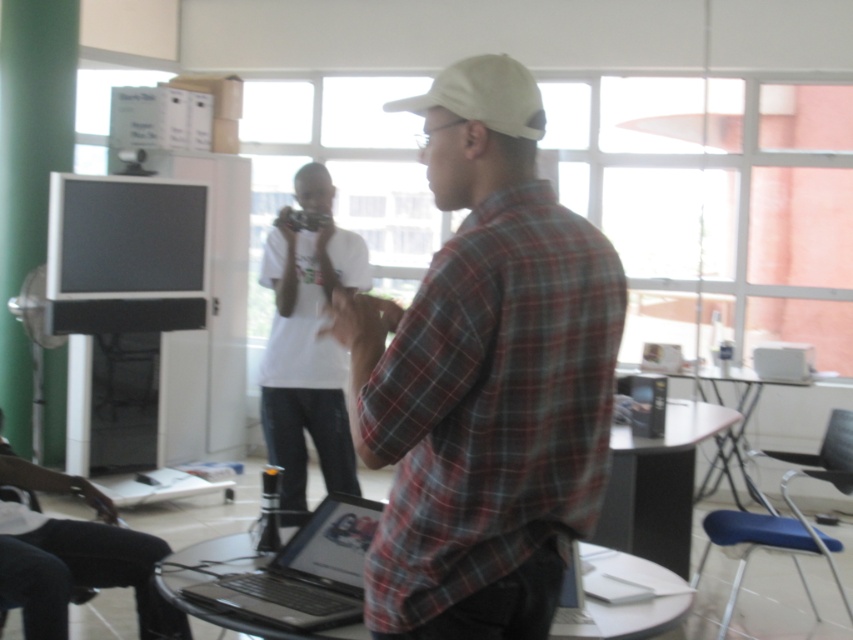
Can you confirm if dark gray fabric pants at lower left is positioned above black glossy laptop at center?

No, dark gray fabric pants at lower left is not above black glossy laptop at center.

Can you confirm if dark gray fabric pants at lower left is positioned below black glossy laptop at center?

Yes.

Who is more distant from viewer, (x=161, y=544) or (x=337, y=545)?

The point (x=161, y=544) is more distant.

This screenshot has width=853, height=640. In order to click on dark gray fabric pants at lower left in this screenshot , I will do `click(74, 557)`.

Can you confirm if black glossy laptop at center is wider than white matte baseball cap at center?

Indeed, black glossy laptop at center has a greater width compared to white matte baseball cap at center.

Who is more distant from viewer, (280, 576) or (474, 76)?

The point (280, 576) is behind.

Between point (361, 582) and point (521, 74), which one is positioned in front?

Point (521, 74)

Locate an element on the screen. This screenshot has height=640, width=853. black glossy laptop at center is located at coordinates (305, 572).

Does blue fabric stool at lower right have a greater height compared to white plastic computer at right?

Yes, blue fabric stool at lower right is taller than white plastic computer at right.

Is blue fabric stool at lower right wider than white plastic computer at right?

Yes, blue fabric stool at lower right is wider than white plastic computer at right.

Based on the photo, measure the distance between blue fabric stool at lower right and camera.

blue fabric stool at lower right is 10.80 feet from camera.

Identify the location of blue fabric stool at lower right. (753, 547).